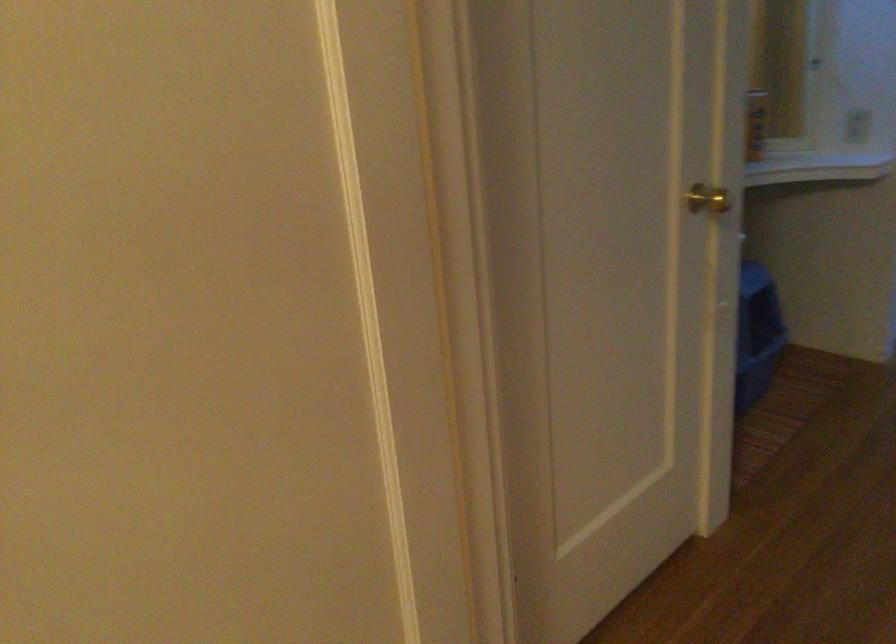
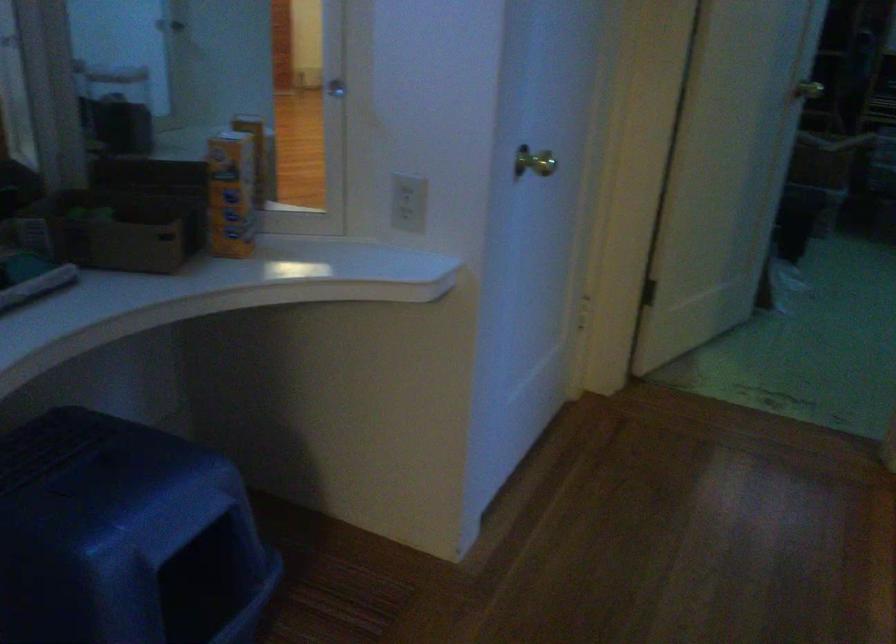
Which direction would the cameraman need to move to produce the second image?

The cameraman moved toward right, forward.